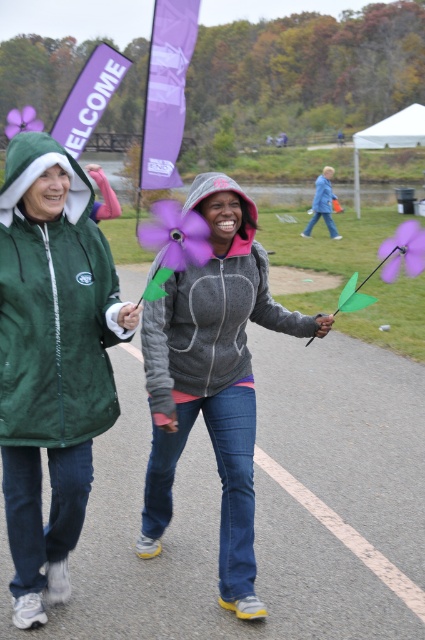
You are standing at the point marked as point (51, 358) in the image. Which object is directly in front of you?

The green fleece jacket at left is located at point (51, 358), so the object directly in front of you is the green fleece jacket at left.

You are standing at the point labeled as point (x=45, y=547) in the image. You want to walk to the nearest tree in the background. How far will you have to walk?

The distance between you and the nearest tree in the background is 3.15 meters, so you will have to walk 3.15 meters to reach it.